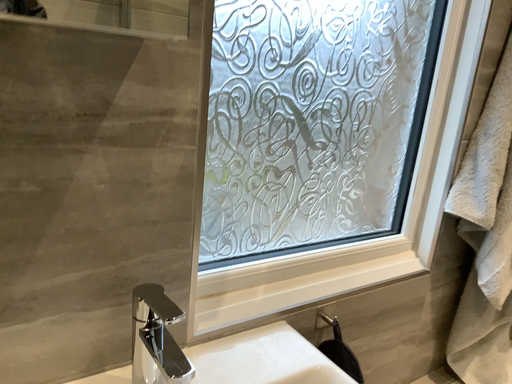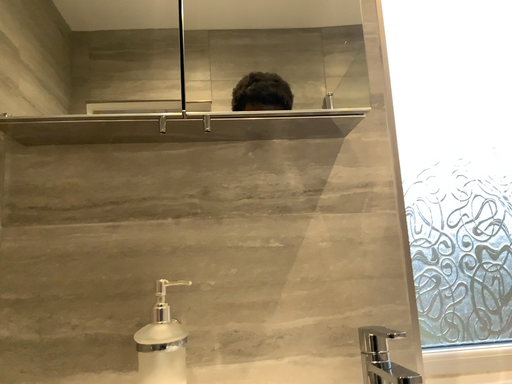
Question: Which way did the camera rotate in the video?

Choices:
 (A) rotated right
 (B) rotated left

Answer: (B)